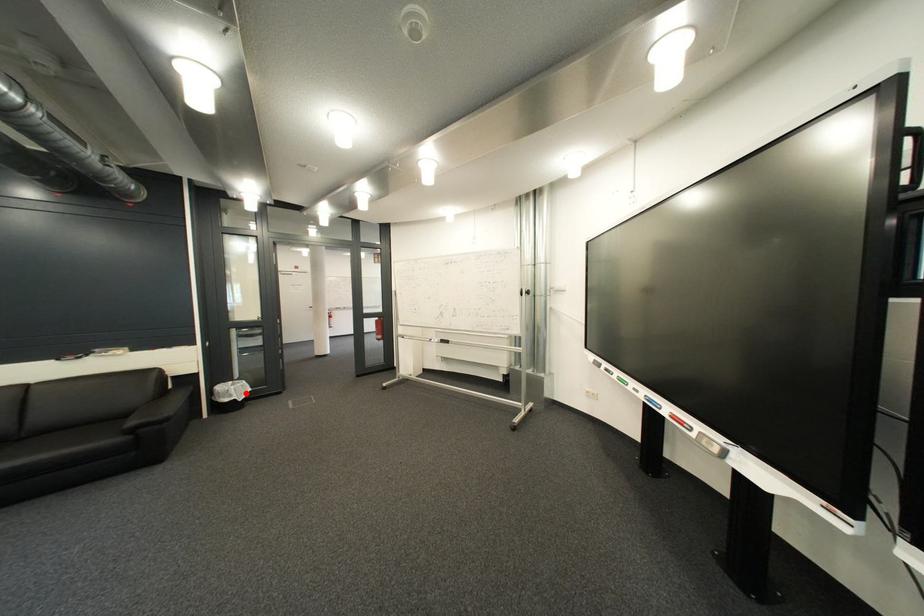
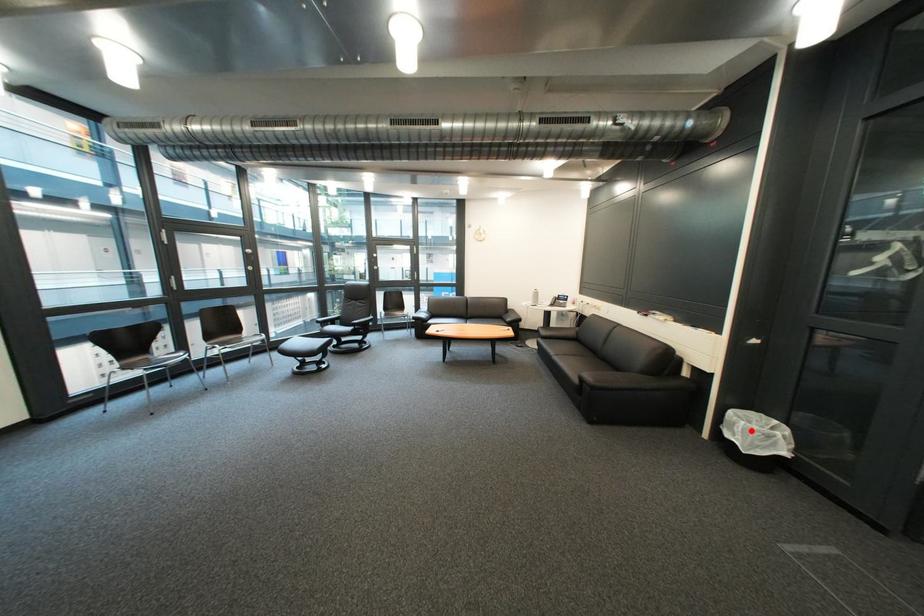
I am providing you with two images of the same scene from different viewpoints. A red point is marked on the first image and another point is marked on the second image. Is the marked point in image1 the same physical position as the marked point in image2?

Yes